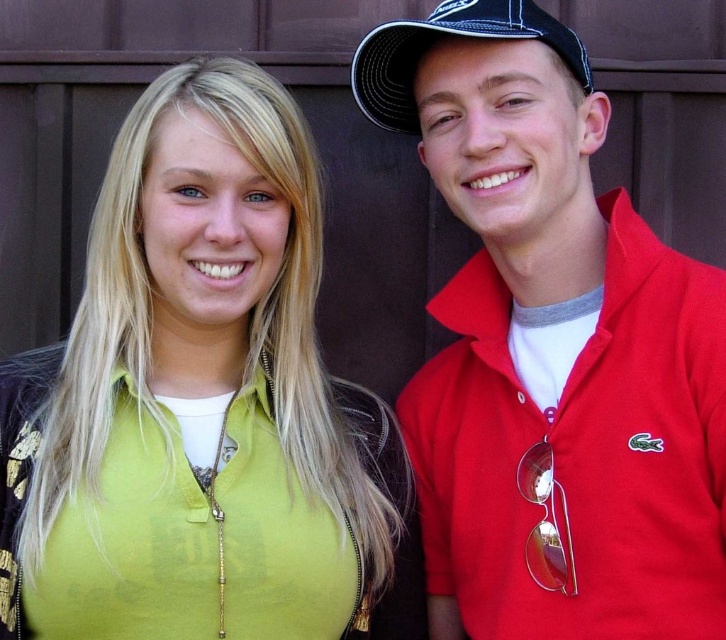
Which of these two, green matte shirt at center or black mesh baseball cap at upper right, stands taller?

Standing taller between the two is green matte shirt at center.

What do you see at coordinates (200, 403) in the screenshot? I see `green matte shirt at center` at bounding box center [200, 403].

Where is `green matte shirt at center`? This screenshot has height=640, width=726. green matte shirt at center is located at coordinates (200, 403).

Which is above, green matte shirt at center or matte red polo shirt at right?

Positioned higher is matte red polo shirt at right.

Is green matte shirt at center to the left of matte red polo shirt at right from the viewer's perspective?

Yes, green matte shirt at center is to the left of matte red polo shirt at right.

Is point (224, 152) more distant than point (534, 310)?

No, it is not.

You are a GUI agent. You are given a task and a screenshot of the screen. Output one action in this format:
    pyautogui.click(x=<x>, y=<y>)
    Task: Click on the green matte shirt at center
    
    Given the screenshot: What is the action you would take?
    pyautogui.click(x=200, y=403)

Which of these two, matte red polo shirt at right or black mesh baseball cap at upper right, stands taller?

matte red polo shirt at right

Does point (608, 451) come closer to viewer compared to point (383, 122)?

Yes, point (608, 451) is in front of point (383, 122).

Who is more forward, [582,397] or [399,108]?

Point [582,397]

What are the coordinates of `matte red polo shirt at right` in the screenshot? It's located at (552, 352).